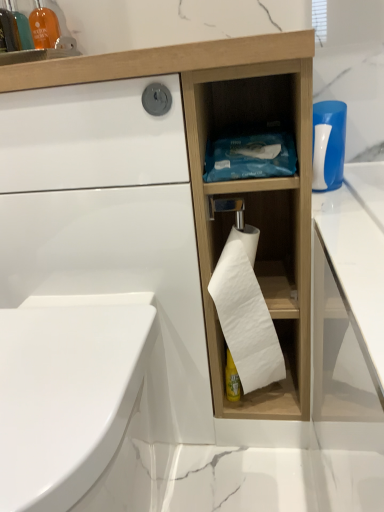
Measure the distance between point (51, 406) and camera.

They are 19.80 inches apart.

At what (x,y) coordinates should I click in order to perform the action: click on white glossy bidet at lower left. Please return your answer as a coordinate pair (x, y). Looking at the image, I should click on (66, 395).

This screenshot has height=512, width=384. Find the location of `matte orange glass at upper left`. matte orange glass at upper left is located at coordinates (34, 36).

Where is `white plastic bottle at upper right`? The width and height of the screenshot is (384, 512). white plastic bottle at upper right is located at coordinates (328, 144).

The height and width of the screenshot is (512, 384). Identify the location of white matte toilet paper at center. (246, 312).

Describe the element at coordinates (246, 312) in the screenshot. The width and height of the screenshot is (384, 512). I see `white matte toilet paper at center` at that location.

Locate an element on the screen. This screenshot has width=384, height=512. white glossy bidet at lower left is located at coordinates (66, 395).

From the image's perspective, is white glossy bidet at lower left above white matte toilet paper at center?

No, from the image's perspective, white glossy bidet at lower left is not above white matte toilet paper at center.

From a real-world perspective, is white glossy bidet at lower left located higher than white matte toilet paper at center?

Actually, white glossy bidet at lower left is physically below white matte toilet paper at center in the real world.

Between white glossy bidet at lower left and white matte toilet paper at center, which one appears on the left side from the viewer's perspective?

white glossy bidet at lower left is more to the left.

Does point (105, 459) come closer to viewer compared to point (268, 346)?

Yes, it is in front of point (268, 346).

Would you say translucent orange bottle at upper left is a long distance from white plastic bottle at upper right?

No.

Where is `cleaning product below the translucent orange bottle at upper left (from the image's perspective)`? The image size is (384, 512). cleaning product below the translucent orange bottle at upper left (from the image's perspective) is located at coordinates (328, 144).

From a real-world perspective, is translucent orange bottle at upper left below white plastic bottle at upper right?

Incorrect, from a real-world perspective, translucent orange bottle at upper left is higher than white plastic bottle at upper right.

Does translucent orange bottle at upper left have a greater height compared to white plastic bottle at upper right?

Correct, translucent orange bottle at upper left is much taller as white plastic bottle at upper right.

From the picture: Which point is more distant from viewer, (338, 126) or (68, 426)?

The point (338, 126) is farther.

How much distance is there between white plastic bottle at upper right and white glossy bidet at lower left?

They are 22.37 inches apart.

Is white plastic bottle at upper right thinner than white glossy bidet at lower left?

Yes.

From the picture: Considering the relative sizes of white plastic bottle at upper right and white glossy bidet at lower left in the image provided, is white plastic bottle at upper right smaller than white glossy bidet at lower left?

Yes, white plastic bottle at upper right is smaller than white glossy bidet at lower left.

Are white glossy bidet at lower left and wooden tissue holder at center making contact?

No, white glossy bidet at lower left is not in contact with wooden tissue holder at center.

From the picture: Can you confirm if white glossy bidet at lower left is smaller than wooden tissue holder at center?

Correct, white glossy bidet at lower left occupies less space than wooden tissue holder at center.

How different are the orientations of white glossy bidet at lower left and wooden tissue holder at center in degrees?

0.211 degrees.

Between white glossy bidet at lower left and wooden tissue holder at center, which one is positioned in front?

white glossy bidet at lower left is in front.

Considering the relative sizes of white matte toilet paper at center and white glossy bidet at lower left in the image provided, is white matte toilet paper at center wider than white glossy bidet at lower left?

A: No.

In terms of size, does white matte toilet paper at center appear bigger or smaller than white glossy bidet at lower left?

Clearly, white matte toilet paper at center is smaller in size than white glossy bidet at lower left.

Which is correct: white matte toilet paper at center is inside white glossy bidet at lower left, or outside of it?

white matte toilet paper at center is not enclosed by white glossy bidet at lower left.

Can you confirm if white glossy bidet at lower left is shorter than matte orange glass at upper left?

No.

Considering the positions of objects white glossy bidet at lower left and matte orange glass at upper left in the image provided, who is more to the right, white glossy bidet at lower left or matte orange glass at upper left?

From the viewer's perspective, white glossy bidet at lower left appears more on the right side.

Which object is more forward, white glossy bidet at lower left or matte orange glass at upper left?

white glossy bidet at lower left is in front.

From the image's perspective, which one is positioned higher, white matte toilet paper at center or translucent orange bottle at upper left?

translucent orange bottle at upper left.

Could you tell me if white matte toilet paper at center is facing translucent orange bottle at upper left?

No, white matte toilet paper at center does not turn towards translucent orange bottle at upper left.

Considering the relative sizes of white matte toilet paper at center and translucent orange bottle at upper left in the image provided, is white matte toilet paper at center thinner than translucent orange bottle at upper left?

No.

Can you confirm if white matte toilet paper at center is taller than translucent orange bottle at upper left?

Yes.

This screenshot has width=384, height=512. In order to click on bidet located underneath the white matte toilet paper at center (from a real-world perspective) in this screenshot , I will do `click(66, 395)`.

This screenshot has height=512, width=384. Find the location of `bottle above the white plastic bottle at upper right (from a real-world perspective)`. bottle above the white plastic bottle at upper right (from a real-world perspective) is located at coordinates (8, 32).

From the picture: From the image, which object appears to be nearer to wooden tissue holder at center, white glossy bidet at lower left or white plastic bottle at upper right?

Among the two, white glossy bidet at lower left is located nearer to wooden tissue holder at center.

When comparing their distances from translucent orange bottle at upper left, does wooden tissue holder at center or white glossy bidet at lower left seem further?

Among the two, white glossy bidet at lower left is located further to translucent orange bottle at upper left.

When comparing their distances from matte orange glass at upper left, does white glossy bidet at lower left or white matte toilet paper at center seem closer?

The object closer to matte orange glass at upper left is white glossy bidet at lower left.

From the image, which object appears to be nearer to matte orange glass at upper left, white glossy bidet at lower left or translucent orange bottle at upper left?

translucent orange bottle at upper left is closer to matte orange glass at upper left.

When comparing their distances from matte orange glass at upper left, does white plastic bottle at upper right or translucent orange bottle at upper left seem further?

Among the two, white plastic bottle at upper right is located further to matte orange glass at upper left.

Considering their positions, is white plastic bottle at upper right positioned closer to translucent orange bottle at upper left than wooden tissue holder at center?

wooden tissue holder at center lies closer to translucent orange bottle at upper left than the other object.

When comparing their distances from translucent orange bottle at upper left, does wooden tissue holder at center or white matte toilet paper at center seem closer?

Based on the image, wooden tissue holder at center appears to be nearer to translucent orange bottle at upper left.

Consider the image. Considering their positions, is wooden tissue holder at center positioned closer to matte orange glass at upper left than white glossy bidet at lower left?

Based on the image, wooden tissue holder at center appears to be nearer to matte orange glass at upper left.

You are a GUI agent. You are given a task and a screenshot of the screen. Output one action in this format:
    pyautogui.click(x=<x>, y=<y>)
    Task: Click on the bathroom cabinet between translucent orange bottle at upper left and white plastic bottle at upper right
    The height and width of the screenshot is (512, 384).
    Given the screenshot: What is the action you would take?
    pyautogui.click(x=165, y=214)

The height and width of the screenshot is (512, 384). I want to click on bathroom cabinet between matte orange glass at upper left and white matte toilet paper at center from top to bottom, so click(x=165, y=214).

Find the location of a particular element. This screenshot has width=384, height=512. toilet paper between wooden tissue holder at center and white plastic bottle at upper right in the horizontal direction is located at coordinates (246, 312).

Where is `bottle between matte orange glass at upper left and wooden tissue holder at center in the up-down direction`? Image resolution: width=384 pixels, height=512 pixels. bottle between matte orange glass at upper left and wooden tissue holder at center in the up-down direction is located at coordinates (8, 32).